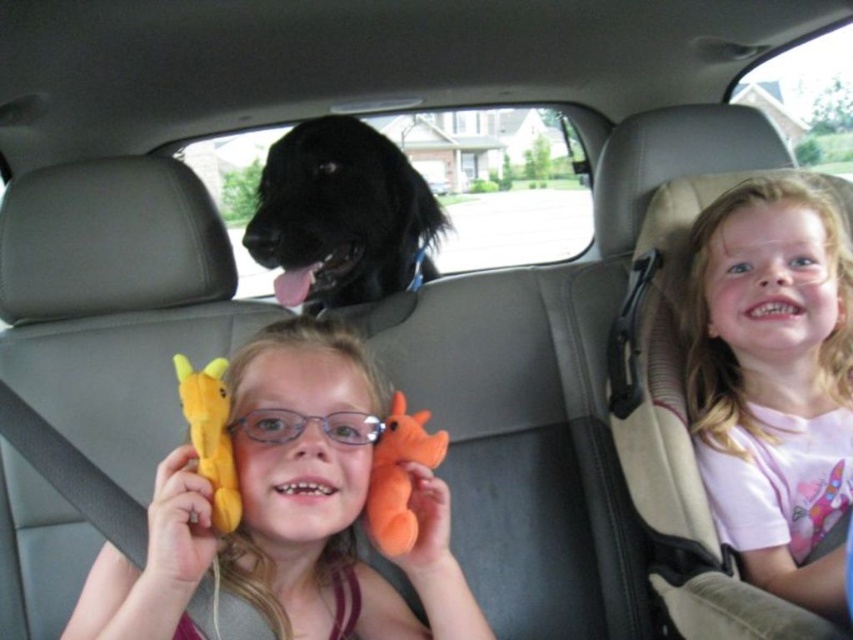
Question: Can you confirm if pink cotton shirt at upper right is positioned to the left of black fur dog at center?

Choices:
 (A) no
 (B) yes

Answer: (A)

Question: Does soft plush toy at center lie in front of orange plush toy at center?

Choices:
 (A) no
 (B) yes

Answer: (B)

Question: Among these points, which one is farthest from the camera?

Choices:
 (A) (380, 436)
 (B) (231, 518)

Answer: (A)

Question: Which of the following is the closest to the observer?

Choices:
 (A) (413, 513)
 (B) (218, 440)
 (C) (361, 269)

Answer: (B)

Question: Which object appears closest to the camera in this image?

Choices:
 (A) orange plush toy at center
 (B) pink cotton shirt at upper right
 (C) soft plush toy at center
 (D) yellow plush giraffe at lower left

Answer: (C)

Question: Does pink cotton shirt at upper right come behind yellow plush giraffe at lower left?

Choices:
 (A) no
 (B) yes

Answer: (B)